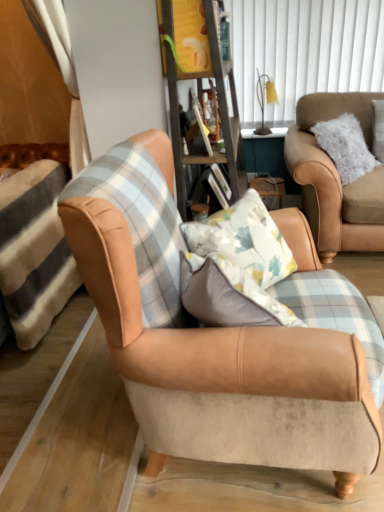
Question: Is wooden bookshelf at center positioned in front of suede tan armchair at right, the 1th chair from the back?

Choices:
 (A) yes
 (B) no

Answer: (A)

Question: From the image's perspective, is wooden bookshelf at center over suede tan armchair at right, placed as the 1th chair when sorted from right to left?

Choices:
 (A) yes
 (B) no

Answer: (A)

Question: Is suede tan armchair at right, the second chair when ordered from left to right, at the back of wooden bookshelf at center?

Choices:
 (A) no
 (B) yes

Answer: (B)

Question: Is wooden bookshelf at center aimed at suede tan armchair at right, placed as the 1th chair when sorted from right to left?

Choices:
 (A) no
 (B) yes

Answer: (B)

Question: Can you confirm if wooden bookshelf at center is taller than suede tan armchair at right, the 1th chair from the back?

Choices:
 (A) no
 (B) yes

Answer: (B)

Question: From a real-world perspective, is wooden bookshelf at center below suede tan armchair at right, the 1th chair from the back?

Choices:
 (A) yes
 (B) no

Answer: (B)

Question: From the image's perspective, is white vertical blinds at upper center on top of suede tan armchair at right, placed as the 1th chair when sorted from right to left?

Choices:
 (A) no
 (B) yes

Answer: (B)

Question: From a real-world perspective, is white vertical blinds at upper center physically below suede tan armchair at right, the 1th chair from the back?

Choices:
 (A) yes
 (B) no

Answer: (B)

Question: Would you consider white vertical blinds at upper center to be distant from suede tan armchair at right, the 1th chair from the back?

Choices:
 (A) yes
 (B) no

Answer: (B)

Question: Considering the relative sizes of white vertical blinds at upper center and suede tan armchair at right, the 1th chair from the back, in the image provided, is white vertical blinds at upper center wider than suede tan armchair at right, the 1th chair from the back,?

Choices:
 (A) no
 (B) yes

Answer: (A)

Question: Can you confirm if white vertical blinds at upper center is positioned to the right of suede tan armchair at right, placed as the 1th chair when sorted from right to left?

Choices:
 (A) yes
 (B) no

Answer: (B)

Question: From a real-world perspective, does white vertical blinds at upper center stand above suede tan armchair at right, the 1th chair from the back?

Choices:
 (A) no
 (B) yes

Answer: (B)

Question: From the image's perspective, is white vertical blinds at upper center over yellow fabric lampshade at upper center?

Choices:
 (A) yes
 (B) no

Answer: (A)